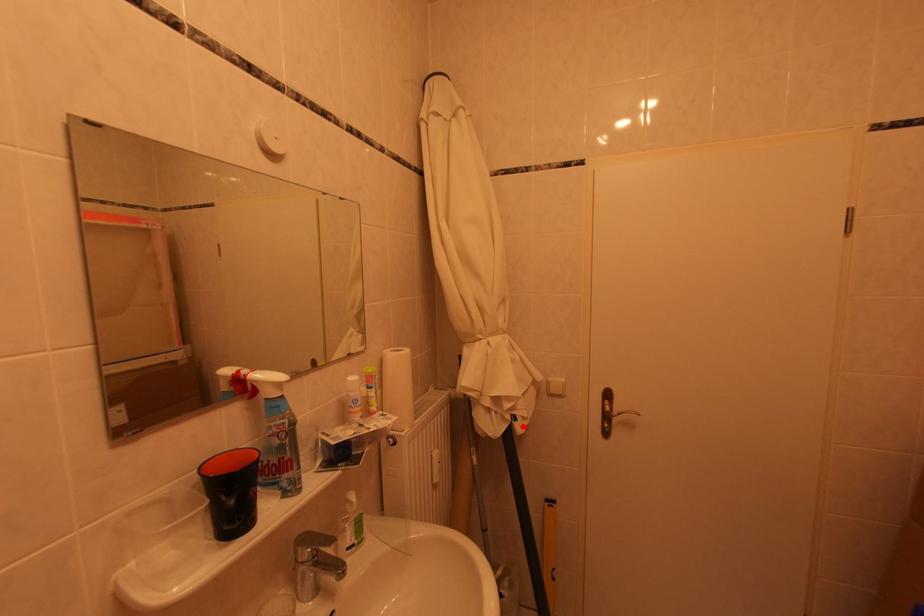
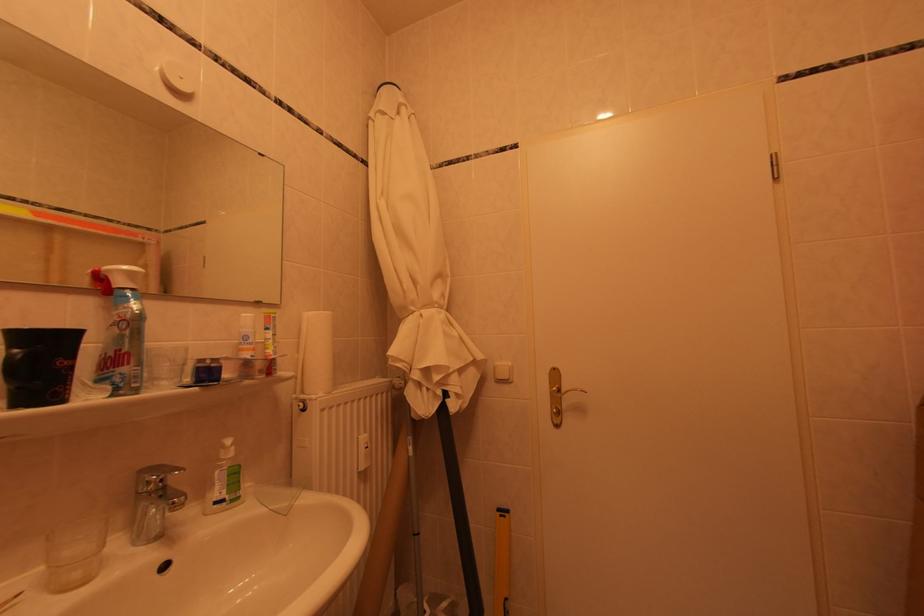
The point at the highlighted location is marked in the first image. Where is the corresponding point in the second image?

(456, 405)